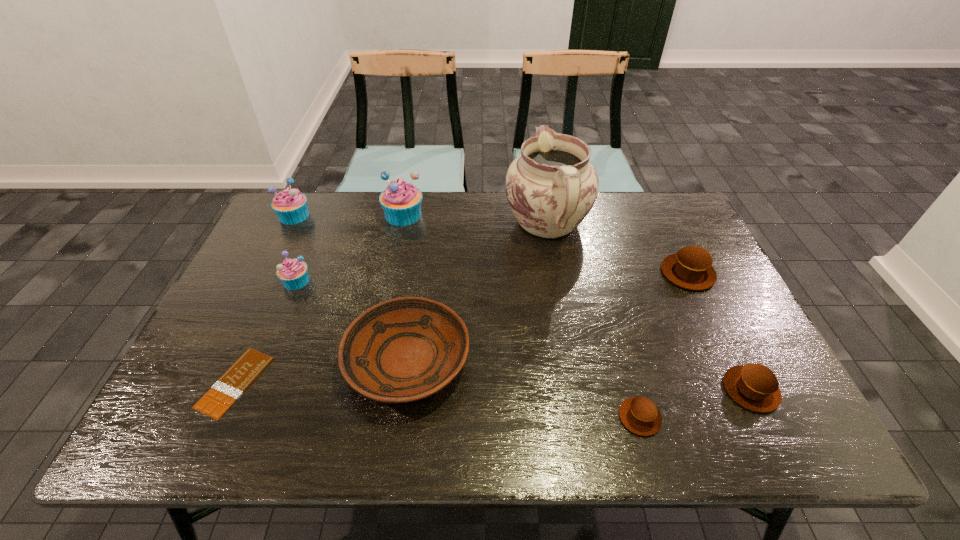
This screenshot has width=960, height=540. In order to click on vacant point located between the plate and the biggest brown muffin in this screenshot , I will do `click(547, 316)`.

The height and width of the screenshot is (540, 960). Find the location of `free space between the second biggest blue muffin and the eighth shortest object`. free space between the second biggest blue muffin and the eighth shortest object is located at coordinates (348, 215).

Locate an element on the screen. This screenshot has height=540, width=960. object that is the seventh nearest to the second smallest brown muffin is located at coordinates (293, 273).

Image resolution: width=960 pixels, height=540 pixels. Find the location of `object that ranks as the seventh closest to the biggest brown muffin`. object that ranks as the seventh closest to the biggest brown muffin is located at coordinates (227, 389).

At what (x,y) coordinates should I click in order to perform the action: click on muffin that stands as the fifth closest to the chocolate bar. Please return your answer as a coordinate pair (x, y). The image size is (960, 540). Looking at the image, I should click on (691, 268).

This screenshot has height=540, width=960. Find the location of `muffin that is the closest one to the second tallest object`. muffin that is the closest one to the second tallest object is located at coordinates (290, 205).

Locate an element on the screen. The width and height of the screenshot is (960, 540). blue muffin that is the second closest to the purple pitcher is located at coordinates (293, 273).

This screenshot has width=960, height=540. I want to click on blue muffin that is the closest to the chocolate bar, so click(293, 273).

Where is `brown muffin that stands as the closest to the purple pitcher`? brown muffin that stands as the closest to the purple pitcher is located at coordinates (691, 268).

Choose which brown muffin is the third nearest neighbor to the second biggest blue muffin. Please provide its 2D coordinates. Your answer should be formatted as a tuple, i.e. [(x, y)], where the tuple contains the x and y coordinates of a point satisfying the conditions above.

[(754, 386)]